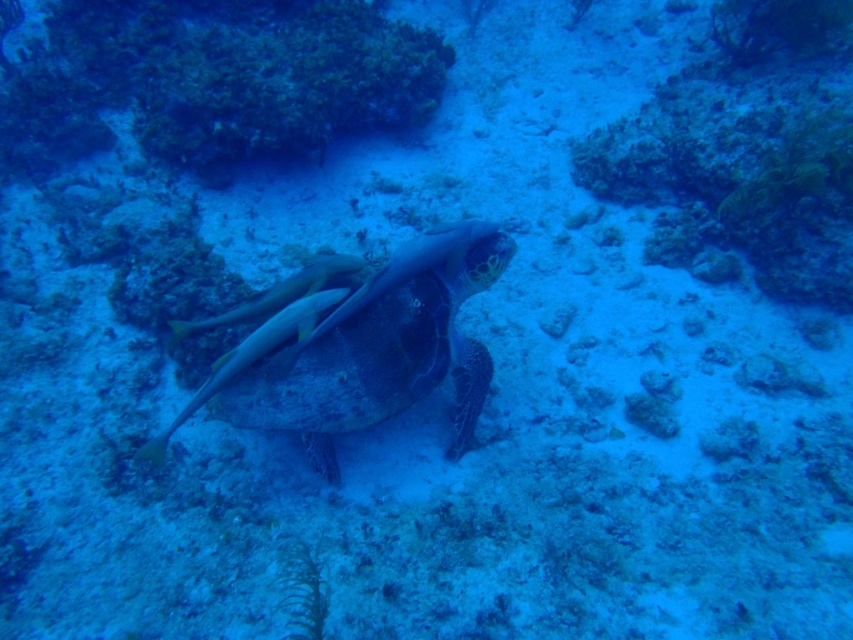
Measure the distance between point (206, 388) and camera.

Point (206, 388) is 6.10 feet away from camera.

Is point (316, 308) farther from viewer compared to point (207, 323)?

That is False.

The height and width of the screenshot is (640, 853). What do you see at coordinates (248, 356) in the screenshot?
I see `yellow-green textured fish at center` at bounding box center [248, 356].

The height and width of the screenshot is (640, 853). What are the coordinates of `yellow-green textured fish at center` in the screenshot? It's located at (248, 356).

From the picture: Between green textured shell at center and yellow-green textured fish at center, which one appears on the right side from the viewer's perspective?

From the viewer's perspective, green textured shell at center appears more on the right side.

Can you confirm if green textured shell at center is positioned below yellow-green textured fish at center?

Yes, green textured shell at center is below yellow-green textured fish at center.

Who is more distant from viewer, (277, 406) or (218, 364)?

The point (277, 406) is more distant.

Identify the location of green textured shell at center. click(379, 349).

What do you see at coordinates (379, 349) in the screenshot? I see `green textured shell at center` at bounding box center [379, 349].

You are a GUI agent. You are given a task and a screenshot of the screen. Output one action in this format:
    pyautogui.click(x=<x>, y=<y>)
    Task: Click on the green textured shell at center
    This screenshot has height=640, width=853.
    Given the screenshot: What is the action you would take?
    pyautogui.click(x=379, y=349)

Locate an element on the screen. This screenshot has height=640, width=853. green textured shell at center is located at coordinates (379, 349).